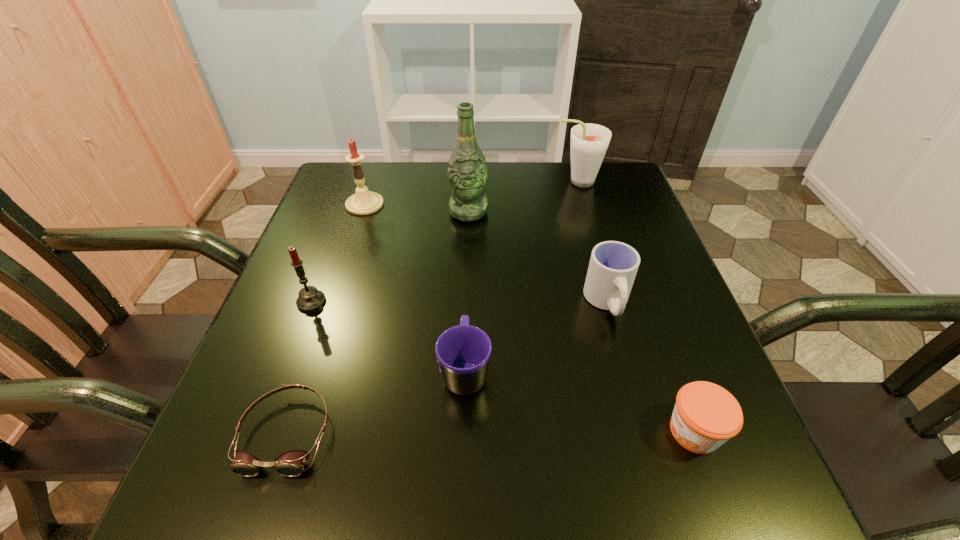
Where is `vacant region located on the drink side of the farthest object`? Image resolution: width=960 pixels, height=540 pixels. vacant region located on the drink side of the farthest object is located at coordinates (442, 181).

Identify the location of free space located 0.310m on the drink side of the farthest object. (438, 181).

Find the location of a particular element. The image size is (960, 540). free space located 0.160m on the drink side of the farthest object is located at coordinates (493, 181).

This screenshot has width=960, height=540. Find the location of `blank space located on the back of the farther candle`. blank space located on the back of the farther candle is located at coordinates (377, 166).

The image size is (960, 540). In order to click on vacant space positioned on the back of the nearer candle in this screenshot , I will do `click(334, 241)`.

Where is `free location located with the handle on the side of the cup`? This screenshot has width=960, height=540. free location located with the handle on the side of the cup is located at coordinates (620, 348).

Locate an element on the screen. This screenshot has width=960, height=540. vacant region located 0.110m with the handle on the side of the mug is located at coordinates (468, 298).

What are the coordinates of `free point located with the handle on the side of the mug` in the screenshot? It's located at (469, 228).

Image resolution: width=960 pixels, height=540 pixels. I want to click on vacant space located with the handle on the side of the mug, so click(469, 225).

Identify the location of vacant space located 0.090m on the front label of the second shortest object. (607, 431).